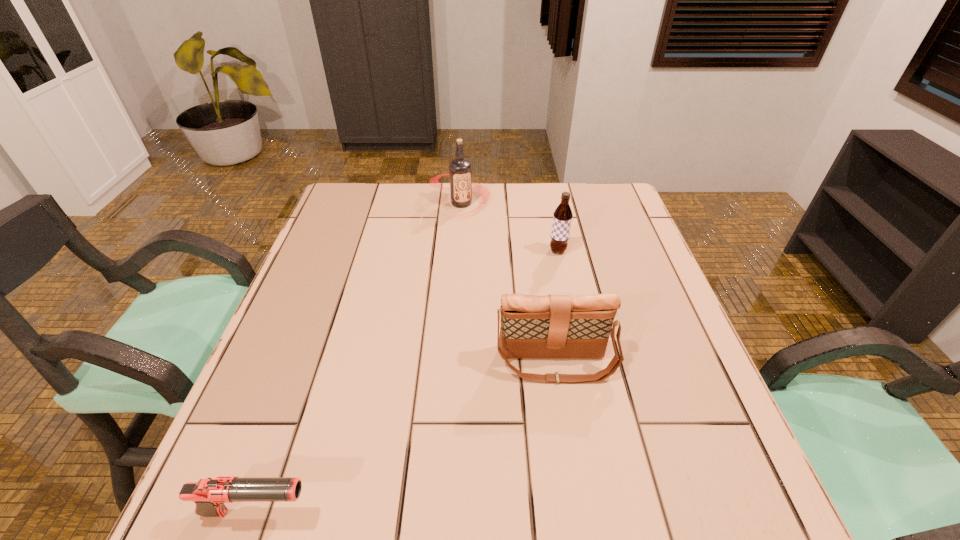
Where is `vacant space located at the aiming end of the shortest object`? vacant space located at the aiming end of the shortest object is located at coordinates (524, 513).

I want to click on object that is at the far edge, so click(460, 171).

Where is `object that is positioned at the near edge`? Image resolution: width=960 pixels, height=540 pixels. object that is positioned at the near edge is located at coordinates (209, 495).

Locate an element on the screen. This screenshot has height=540, width=960. object at the left edge is located at coordinates (209, 495).

Locate an element on the screen. object present at the near left corner is located at coordinates (209, 495).

Identify the location of vacant space at the far edge of the desktop. The image size is (960, 540). (534, 199).

This screenshot has height=540, width=960. Identify the location of free space at the near edge of the desktop. (599, 525).

You are a GUI agent. You are given a task and a screenshot of the screen. Output one action in this format:
    pyautogui.click(x=<x>, y=<y>)
    Task: Click on the free point at the left edge
    This screenshot has width=960, height=540.
    Given the screenshot: What is the action you would take?
    pyautogui.click(x=345, y=338)

Where is `vacant space at the right edge`? The image size is (960, 540). vacant space at the right edge is located at coordinates (646, 360).

Identify the location of free space at the far left corner of the desktop. (387, 183).